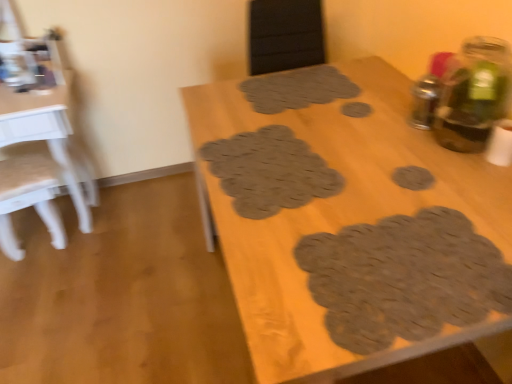
Where is `free spot behind brown felt coaster at center, acting as the 2th footprint starting from the top`? free spot behind brown felt coaster at center, acting as the 2th footprint starting from the top is located at coordinates (355, 91).